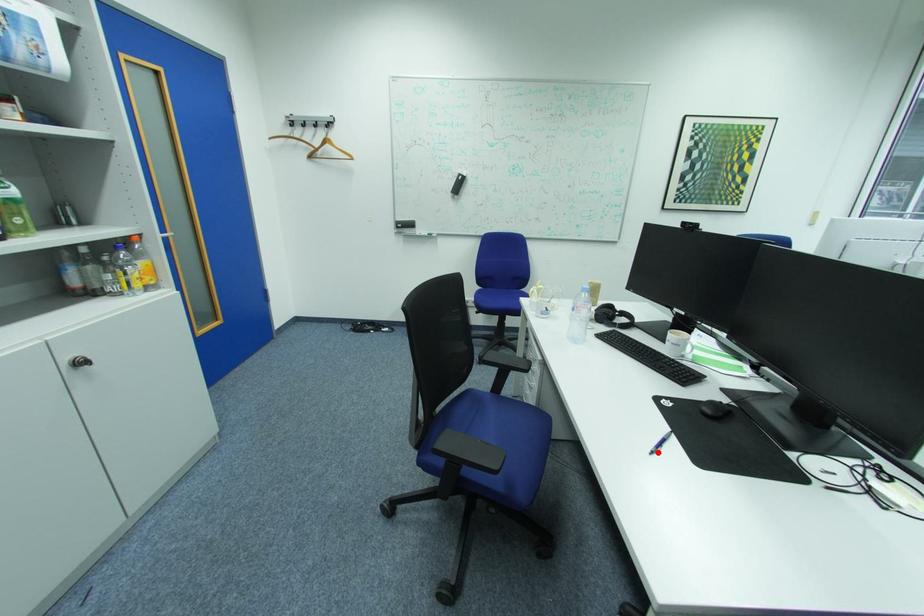
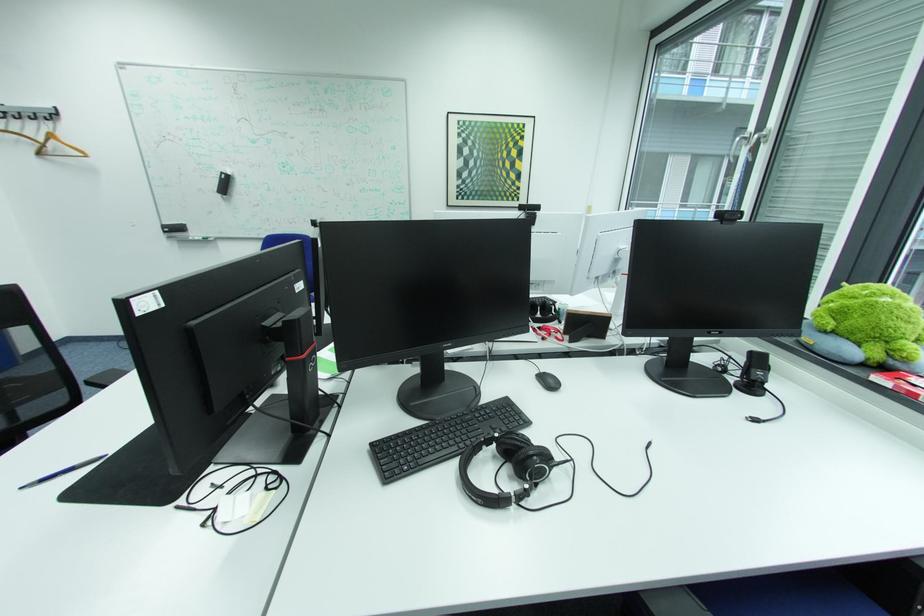
Question: A red point is marked in image1. In image2, is the corresponding 3D point closer to the camera or farther? Reply with the corresponding letter.

Choices:
 (A) The corresponding 3D point is closer.
 (B) The corresponding 3D point is farther.

Answer: (A)